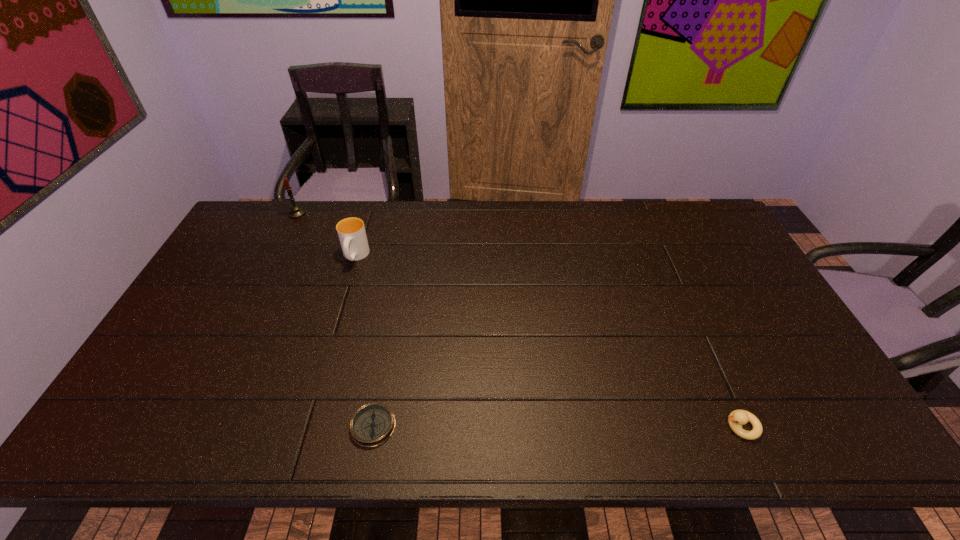
Find the location of a particular element. The image size is (960, 540). vacant region at the near edge is located at coordinates (326, 443).

Where is `free region at the left edge of the desktop`? The image size is (960, 540). free region at the left edge of the desktop is located at coordinates [x=250, y=271].

I want to click on vacant space at the right edge, so click(x=840, y=407).

Locate an element on the screen. This screenshot has width=960, height=540. vacant space at the far left corner is located at coordinates (244, 233).

Image resolution: width=960 pixels, height=540 pixels. I want to click on unoccupied area between the second object from right to left and the rightmost object, so click(557, 426).

This screenshot has height=540, width=960. I want to click on free area in between the third tallest object and the compass, so click(557, 426).

I want to click on free point between the third tallest object and the shortest object, so click(x=557, y=426).

You are a GUI agent. You are given a task and a screenshot of the screen. Output one action in this format:
    pyautogui.click(x=<x>, y=<y>)
    Task: Click on the free space between the leftmost object and the duckling
    The image size is (960, 540).
    Given the screenshot: What is the action you would take?
    pyautogui.click(x=519, y=320)

Image resolution: width=960 pixels, height=540 pixels. I want to click on unoccupied area between the farthest object and the duckling, so click(x=519, y=320).

At what (x,y) coordinates should I click in order to perform the action: click on empty space that is in between the candle and the second shortest object. Please return your answer as a coordinate pair (x, y). Looking at the image, I should click on (519, 320).